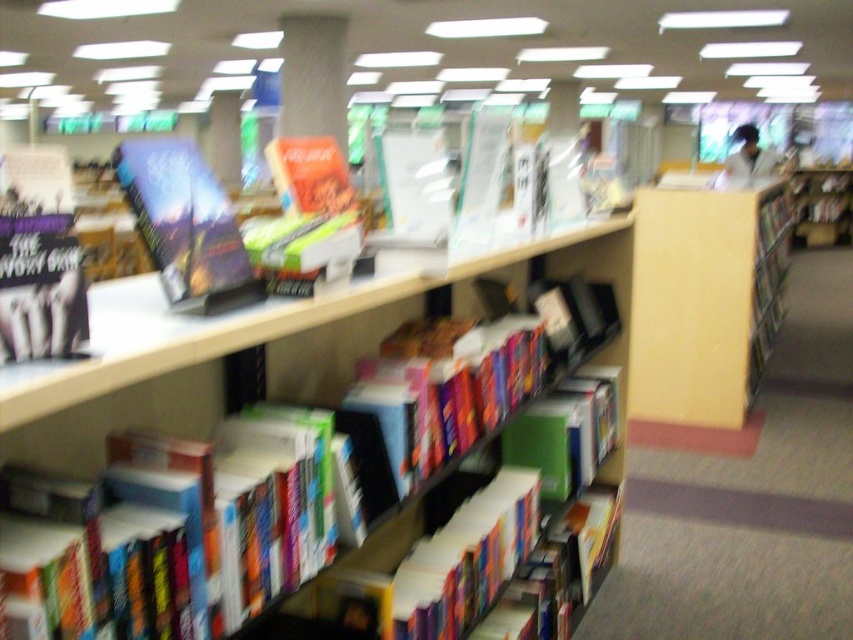
Consider the image. You are a customer looking for a book in the bookstore. You notice two hardcover books at center and a hardcover book at upper left. Which one is closer to you?

The hardcover books at center is closer to you because it is in front of the hardcover book at upper left.

You are a customer looking for a specific book in the bookstore. You notice the hardcover book at left and the hardcover books at center. Which one is positioned higher on the shelf?

The hardcover book at left is positioned higher on the shelf than the hardcover books at center.

You are a customer in the bookstore looking for a book to place on a shelf at home. You see the hardcover book at left and the hardcover book at upper left. Which one is taller?

The hardcover book at left is much taller than the hardcover book at upper left.